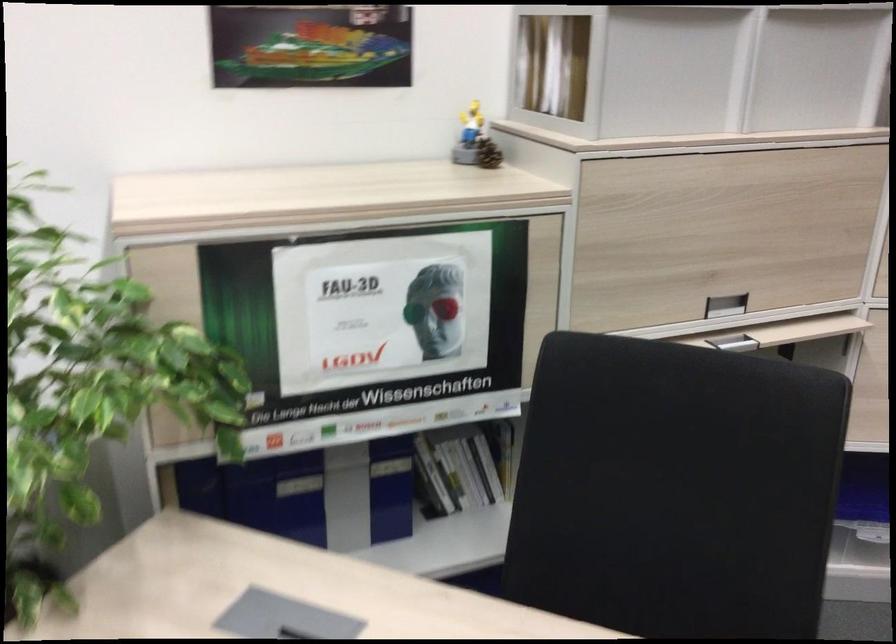
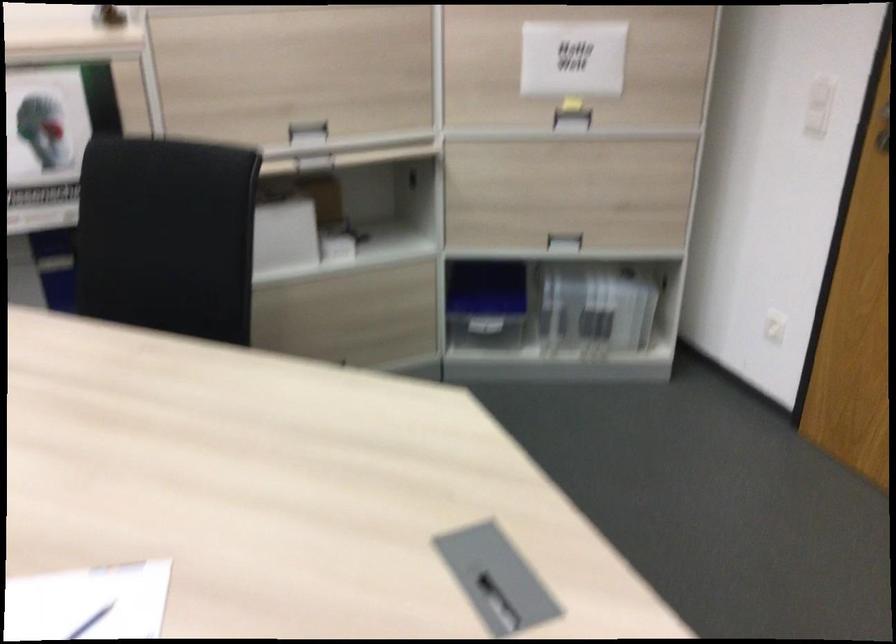
In the second image, find the point that corresponds to (719,295) in the first image.

(307, 129)